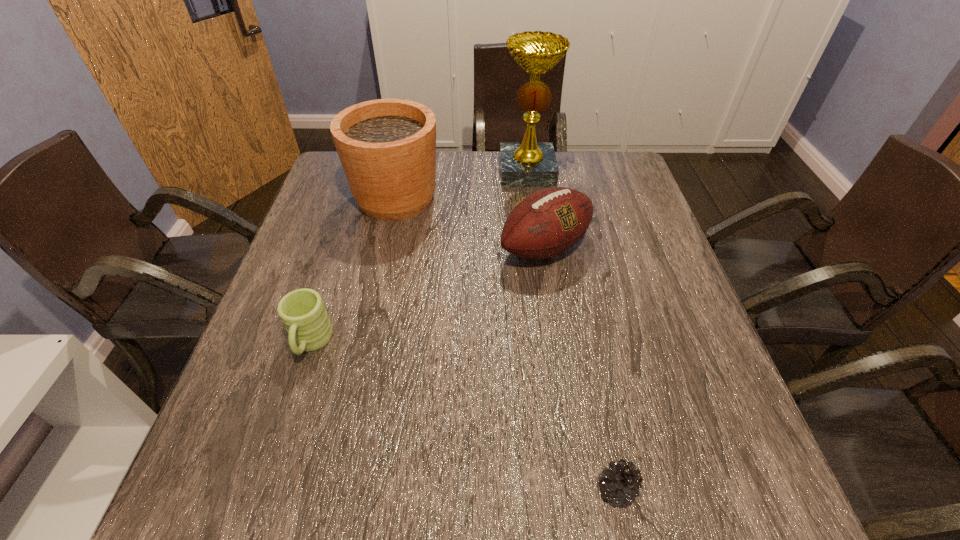
Find the location of a particular element. The height and width of the screenshot is (540, 960). vacant point located 0.220m on the side of the mug with the handle is located at coordinates (264, 487).

You are a GUI agent. You are given a task and a screenshot of the screen. Output one action in this format:
    pyautogui.click(x=<x>, y=<y>)
    Task: Click on the vacant region located 0.100m on the left of the nearest object
    The image size is (960, 540).
    Given the screenshot: What is the action you would take?
    pyautogui.click(x=535, y=489)

Where is `award situated at the far edge`? award situated at the far edge is located at coordinates (529, 163).

The image size is (960, 540). What are the coordinates of `flowerpot that is at the far edge` in the screenshot? It's located at (387, 147).

What are the coordinates of `object present at the near edge` in the screenshot? It's located at (621, 485).

Locate an element on the screen. Image resolution: width=960 pixels, height=540 pixels. flowerpot that is at the left edge is located at coordinates (387, 147).

I want to click on mug that is at the left edge, so click(x=302, y=311).

Where is `object present at the far left corner`? The image size is (960, 540). object present at the far left corner is located at coordinates (387, 147).

The width and height of the screenshot is (960, 540). What are the coordinates of `vacant position at the left edge of the desktop` in the screenshot? It's located at (302, 254).

You are a GUI agent. You are given a task and a screenshot of the screen. Output one action in this format:
    pyautogui.click(x=<x>, y=<y>)
    Task: Click on the free region at the right edge of the desktop
    The height and width of the screenshot is (540, 960).
    Given the screenshot: What is the action you would take?
    (620, 249)